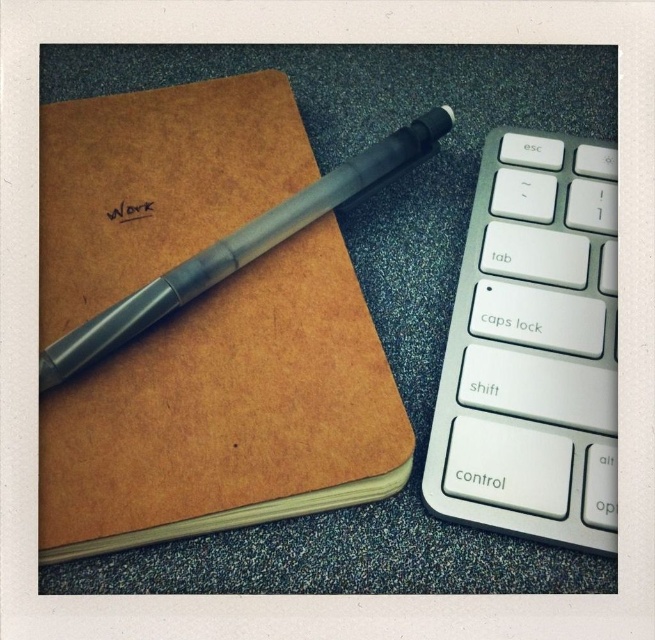
You are organizing your desk and need to place a new item between the brown leather notebook at upper left and the silver metallic keyboard at right. Based on their positions, which object should you place the new item closer to?

The new item should be placed closer to the silver metallic keyboard at right because the brown leather notebook at upper left is closer to the viewer, meaning the keyboard is farther away. To place the new item between them, it should be closer to the keyboard to maintain the spatial order.

You are organizing a desk and need to place a new item between the brown leather notebook at upper left and the silver metallic keyboard at right. Based on their positions, where should you place the new item?

The new item should be placed between the brown leather notebook at upper left and the silver metallic keyboard at right, but since the brown leather notebook at upper left is above the keyboard, the new item can be placed in the space below the notebook and above the keyboard to fit between them.

You are a remote worker who needs to reach both the brown leather notebook at upper left and the silver metallic keyboard at right. If your hand can stretch 10 inches, can you comfortably reach both items without moving your arm?

The distance between the brown leather notebook at upper left and the silver metallic keyboard at right is 10.06 inches. Since your hand can stretch 10 inches, you cannot comfortably reach both items without moving your arm because the distance is slightly more than your reach.